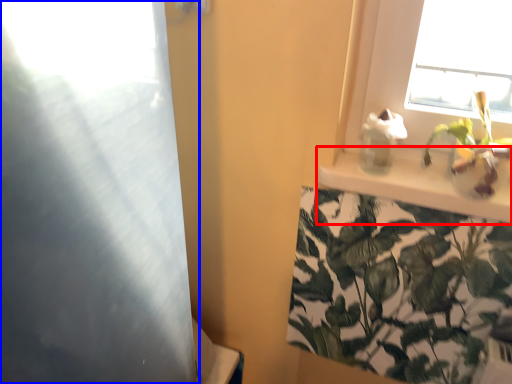
Question: Which point is closer to the camera, window sill (highlighted by a red box) or screen door (highlighted by a blue box)?

Choices:
 (A) window sill
 (B) screen door

Answer: (B)